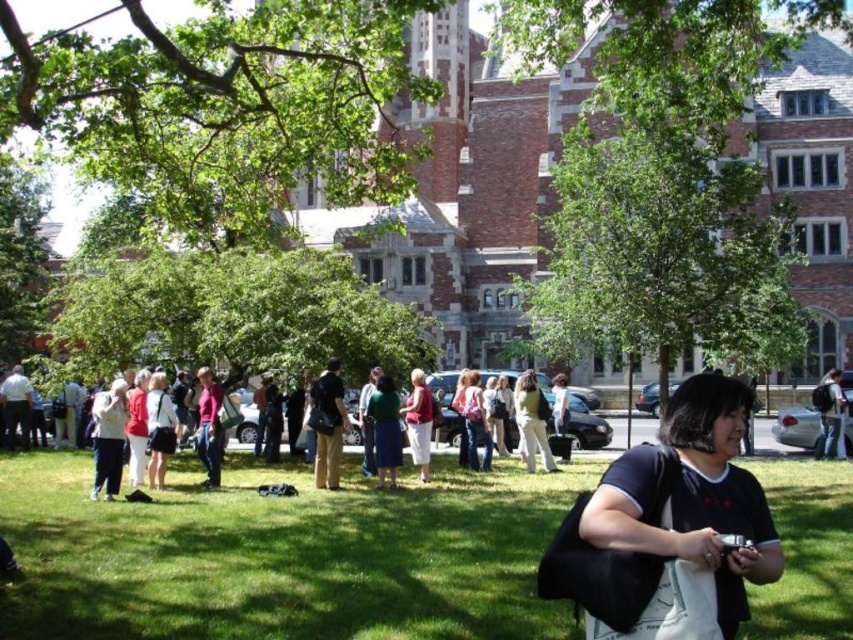
Between green leafy tree at upper left and green leafy tree at center, which one is positioned lower?

green leafy tree at center is lower down.

Does green leafy tree at upper left have a greater height compared to green leafy tree at center?

Correct, green leafy tree at upper left is much taller as green leafy tree at center.

Identify the location of green leafy tree at upper left. (227, 106).

Find the location of a particular element. green leafy tree at upper left is located at coordinates (227, 106).

Does point (392, 385) lie in front of point (151, 381)?

No, (392, 385) is further to viewer.

Which is in front, point (397, 442) or point (155, 385)?

Point (155, 385) is more forward.

Where is `green fabric dress at center`? This screenshot has width=853, height=640. green fabric dress at center is located at coordinates (386, 428).

Is khaki pants at center taller than green fabric dress at center?

Yes.

Can you confirm if khaki pants at center is positioned to the left of green fabric dress at center?

Yes, khaki pants at center is to the left of green fabric dress at center.

Is point (322, 452) positioned after point (381, 460)?

That is True.

Locate an element on the screen. The image size is (853, 640). khaki pants at center is located at coordinates (328, 424).